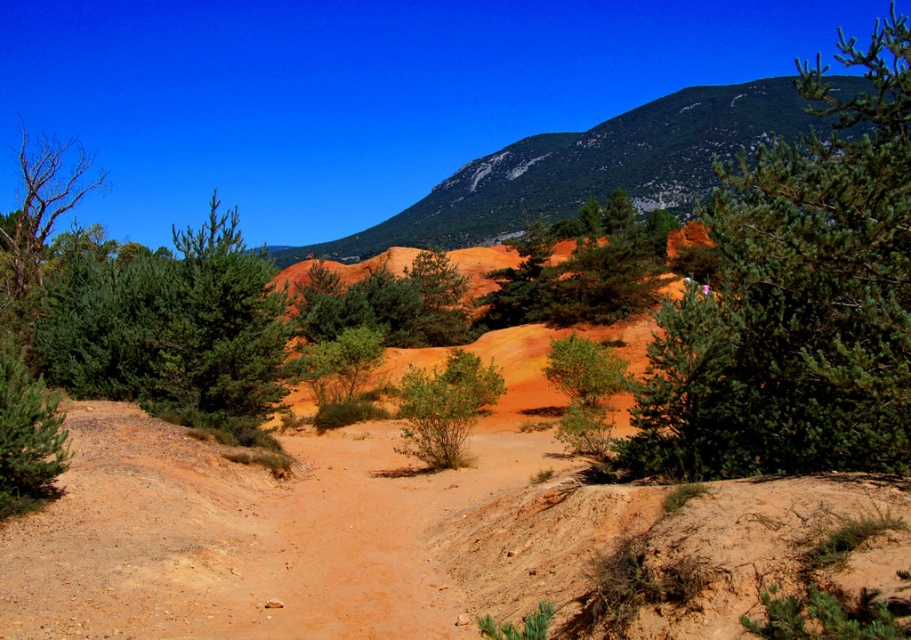
You are a hiker trying to navigate through the landscape. You notice two plants at the center of the image, the green textured pine at center and the green matte bush at center. Which one would you choose to use as a landmark for navigation, and why?

The green textured pine at center would be a better landmark because it is larger in size compared to the green matte bush at center, making it more noticeable and easier to identify from a distance.

You are standing on the dirt path and looking towards the orange area. Which of the two bushes, the green textured bush at left or the green leafy bush at center, is closer to your line of sight?

The green textured bush at left is closer to your line of sight because it is positioned above the green leafy bush at center, indicating it is nearer in the scene.